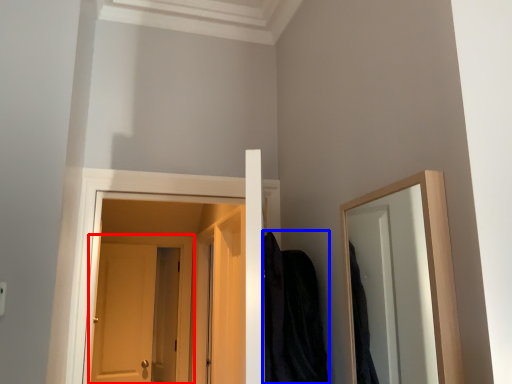
Question: Which object appears closest to the camera in this image, door (highlighted by a red box) or robe (highlighted by a blue box)?

Choices:
 (A) door
 (B) robe

Answer: (B)